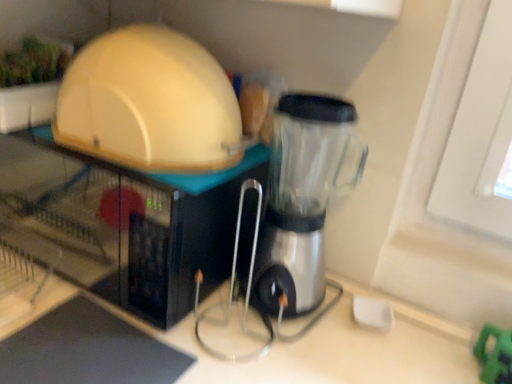
What do you see at coordinates (123, 223) in the screenshot?
I see `matte white microwave at upper left, the 2th appliance from the top` at bounding box center [123, 223].

Image resolution: width=512 pixels, height=384 pixels. I want to click on matte white microwave at upper left, the first appliance from the bottom, so click(123, 223).

Find the location of a particular element. transparent plastic blender at center is located at coordinates (304, 197).

Which point is more forward, (164, 283) or (80, 127)?

Positioned in front is point (164, 283).

Where is `appliance that appears below the matte white dome at upper left, acting as the second appliance starting from the bottom (from the image's perspective)`? appliance that appears below the matte white dome at upper left, acting as the second appliance starting from the bottom (from the image's perspective) is located at coordinates (x=123, y=223).

In the scene shown: Considering the relative positions of matte white microwave at upper left, the first appliance from the bottom, and matte white dome at upper left, acting as the first appliance starting from the top, in the image provided, is matte white microwave at upper left, the first appliance from the bottom, to the left of matte white dome at upper left, acting as the first appliance starting from the top, from the viewer's perspective?

Yes.

How distant is matte white microwave at upper left, the 2th appliance from the top, from matte white dome at upper left, acting as the second appliance starting from the bottom?

matte white microwave at upper left, the 2th appliance from the top, and matte white dome at upper left, acting as the second appliance starting from the bottom, are 7.11 inches apart from each other.

Which is correct: transparent plastic blender at center is inside matte white microwave at upper left, the first appliance from the bottom, or outside of it?

transparent plastic blender at center exists outside the volume of matte white microwave at upper left, the first appliance from the bottom.

In terms of width, does transparent plastic blender at center look wider or thinner when compared to matte white microwave at upper left, the first appliance from the bottom?

Considering their sizes, transparent plastic blender at center looks slimmer than matte white microwave at upper left, the first appliance from the bottom.

Can you see transparent plastic blender at center touching matte white microwave at upper left, the first appliance from the bottom?

No, transparent plastic blender at center is not touching matte white microwave at upper left, the first appliance from the bottom.

Is transparent plastic blender at center bigger or smaller than matte white microwave at upper left, the first appliance from the bottom?

transparent plastic blender at center is smaller than matte white microwave at upper left, the first appliance from the bottom.

Is transparent plastic blender at center inside the boundaries of matte white dome at upper left, acting as the second appliance starting from the bottom, or outside?

transparent plastic blender at center is not inside matte white dome at upper left, acting as the second appliance starting from the bottom, it's outside.

In the scene shown: What's the angular difference between transparent plastic blender at center and matte white dome at upper left, acting as the first appliance starting from the top,'s facing directions?

0.000391 degrees separate the facing orientations of transparent plastic blender at center and matte white dome at upper left, acting as the first appliance starting from the top.

Between transparent plastic blender at center and matte white dome at upper left, acting as the second appliance starting from the bottom, which one appears on the right side from the viewer's perspective?

transparent plastic blender at center is more to the right.

Which of these two, transparent plastic blender at center or matte white dome at upper left, acting as the first appliance starting from the top, stands shorter?

Standing shorter between the two is matte white dome at upper left, acting as the first appliance starting from the top.

Considering the positions of point (74, 92) and point (201, 233), is point (74, 92) closer or farther from the camera than point (201, 233)?

Point (74, 92) is farther from the camera than point (201, 233).

What are the coordinates of `appliance that appears below the matte white dome at upper left, acting as the second appliance starting from the bottom (from a real-world perspective)` in the screenshot? It's located at tap(123, 223).

Is matte white dome at upper left, acting as the second appliance starting from the bottom, taller or shorter than matte white microwave at upper left, the first appliance from the bottom?

Clearly, matte white dome at upper left, acting as the second appliance starting from the bottom, is shorter compared to matte white microwave at upper left, the first appliance from the bottom.

Considering the sizes of objects matte white microwave at upper left, the first appliance from the bottom, and transparent plastic blender at center in the image provided, who is shorter, matte white microwave at upper left, the first appliance from the bottom, or transparent plastic blender at center?

matte white microwave at upper left, the first appliance from the bottom.

Choose the correct answer: Is matte white microwave at upper left, the 2th appliance from the top, inside transparent plastic blender at center or outside it?

The correct answer is: outside.

Can you confirm if matte white microwave at upper left, the first appliance from the bottom, is thinner than transparent plastic blender at center?

Incorrect, the width of matte white microwave at upper left, the first appliance from the bottom, is not less than that of transparent plastic blender at center.

Is matte white microwave at upper left, the 2th appliance from the top, at the left side of transparent plastic blender at center?

Indeed, matte white microwave at upper left, the 2th appliance from the top, is positioned on the left side of transparent plastic blender at center.

From a real-world perspective, relative to transparent plastic blender at center, is matte white dome at upper left, acting as the first appliance starting from the top, vertically above or below?

matte white dome at upper left, acting as the first appliance starting from the top, is situated higher than transparent plastic blender at center in the real world.

Does matte white dome at upper left, acting as the second appliance starting from the bottom, have a larger size compared to transparent plastic blender at center?

Correct, matte white dome at upper left, acting as the second appliance starting from the bottom, is larger in size than transparent plastic blender at center.

Can you confirm if matte white dome at upper left, acting as the first appliance starting from the top, is shorter than transparent plastic blender at center?

Yes, matte white dome at upper left, acting as the first appliance starting from the top, is shorter than transparent plastic blender at center.

Considering the sizes of objects matte white dome at upper left, acting as the second appliance starting from the bottom, and transparent plastic blender at center in the image provided, who is wider, matte white dome at upper left, acting as the second appliance starting from the bottom, or transparent plastic blender at center?

Wider between the two is matte white dome at upper left, acting as the second appliance starting from the bottom.

The image size is (512, 384). I want to click on appliance on the right side of matte white microwave at upper left, the 2th appliance from the top, so click(x=150, y=103).

The image size is (512, 384). In order to click on blender below the matte white microwave at upper left, the first appliance from the bottom (from the image's perspective) in this screenshot , I will do coord(304,197).

Based on their spatial positions, is transparent plastic blender at center or matte white dome at upper left, acting as the second appliance starting from the bottom, further from matte white microwave at upper left, the 2th appliance from the top?

transparent plastic blender at center lies further to matte white microwave at upper left, the 2th appliance from the top, than the other object.

Considering their positions, is matte white microwave at upper left, the first appliance from the bottom, positioned further to matte white dome at upper left, acting as the second appliance starting from the bottom, than transparent plastic blender at center?

Among the two, transparent plastic blender at center is located further to matte white dome at upper left, acting as the second appliance starting from the bottom.

Looking at the image, which one is located closer to transparent plastic blender at center, matte white microwave at upper left, the 2th appliance from the top, or matte white dome at upper left, acting as the second appliance starting from the bottom?

Among the two, matte white dome at upper left, acting as the second appliance starting from the bottom, is located nearer to transparent plastic blender at center.

Estimate the real-world distances between objects in this image. Which object is closer to matte white dome at upper left, acting as the second appliance starting from the bottom, transparent plastic blender at center or matte white microwave at upper left, the first appliance from the bottom?

Based on the image, matte white microwave at upper left, the first appliance from the bottom, appears to be nearer to matte white dome at upper left, acting as the second appliance starting from the bottom.

Looking at the image, which one is located closer to transparent plastic blender at center, matte white dome at upper left, acting as the first appliance starting from the top, or matte white microwave at upper left, the first appliance from the bottom?

Based on the image, matte white dome at upper left, acting as the first appliance starting from the top, appears to be nearer to transparent plastic blender at center.

Looking at the image, which one is located further to matte white microwave at upper left, the first appliance from the bottom, matte white dome at upper left, acting as the second appliance starting from the bottom, or transparent plastic blender at center?

Among the two, transparent plastic blender at center is located further to matte white microwave at upper left, the first appliance from the bottom.

Locate an element on the screen. appliance between matte white microwave at upper left, the first appliance from the bottom, and transparent plastic blender at center from left to right is located at coordinates (150, 103).